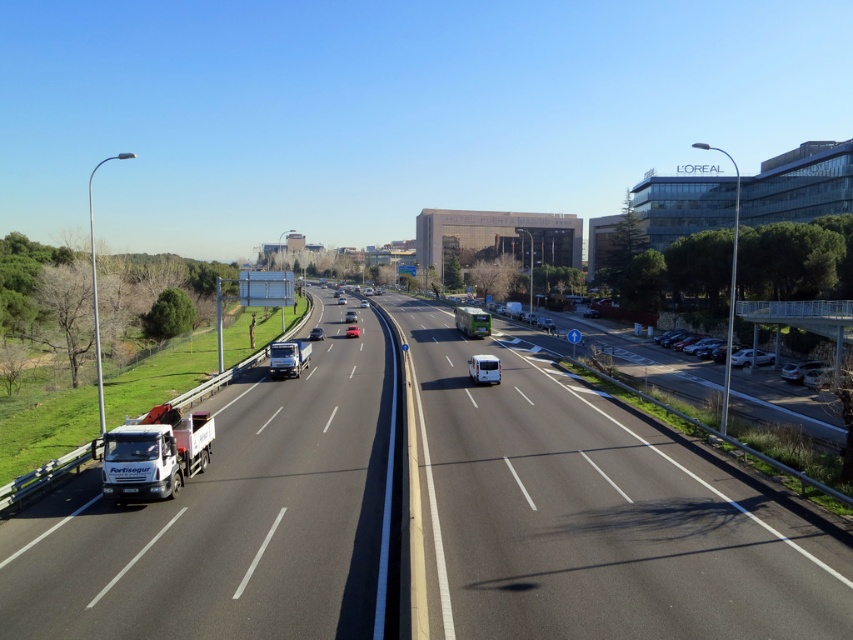
You are a drone operator trying to capture aerial footage of the highway. You notice two points marked on your screen at coordinates point [488,314] and point [479,380]. Which point is closer to your drone camera?

Point [488,314] is further to the camera than point [479,380], so the point closer to the drone camera is point [479,380].

You are standing at the origin point of the image. Which direction should you walk to reach the white glossy van at center?

You should walk towards the northeast direction to reach the white glossy van at center located at point (485, 369).